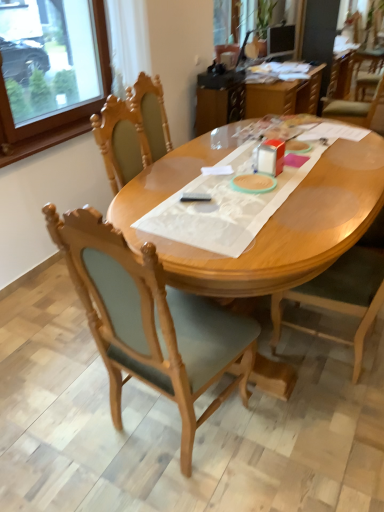
Question: Is wooden chair at center, the 2th chair viewed from the left, to the right of wooden chair at center, which is counted as the 2th chair, starting from the right, from the viewer's perspective?

Choices:
 (A) yes
 (B) no

Answer: (A)

Question: Considering the relative sizes of wooden chair at center, placed as the 1th chair when sorted from right to left, and wooden chair at center, which is counted as the 2th chair, starting from the right, in the image provided, is wooden chair at center, placed as the 1th chair when sorted from right to left, bigger than wooden chair at center, which is counted as the 2th chair, starting from the right,?

Choices:
 (A) yes
 (B) no

Answer: (A)

Question: From a real-world perspective, is wooden chair at center, the 2th chair viewed from the left, physically above wooden chair at center, placed as the 1th chair when sorted from left to right?

Choices:
 (A) no
 (B) yes

Answer: (A)

Question: Considering the relative positions of wooden chair at center, placed as the 1th chair when sorted from right to left, and wooden chair at center, placed as the 1th chair when sorted from left to right, in the image provided, is wooden chair at center, placed as the 1th chair when sorted from right to left, behind wooden chair at center, placed as the 1th chair when sorted from left to right,?

Choices:
 (A) yes
 (B) no

Answer: (A)

Question: Can you confirm if wooden chair at center, placed as the 1th chair when sorted from right to left, is taller than wooden chair at center, placed as the 1th chair when sorted from left to right?

Choices:
 (A) yes
 (B) no

Answer: (A)

Question: In the image, is wooden chair at center, placed as the 1th chair when sorted from left to right, positioned in front of or behind wooden frame at upper left?

Choices:
 (A) behind
 (B) front

Answer: (B)

Question: In terms of height, does wooden chair at center, which is counted as the 2th chair, starting from the right, look taller or shorter compared to wooden frame at upper left?

Choices:
 (A) short
 (B) tall

Answer: (B)

Question: Looking at the image, does wooden chair at center, which is counted as the 2th chair, starting from the right, seem bigger or smaller compared to wooden frame at upper left?

Choices:
 (A) big
 (B) small

Answer: (B)

Question: In terms of width, does wooden chair at center, placed as the 1th chair when sorted from left to right, look wider or thinner when compared to wooden frame at upper left?

Choices:
 (A) thin
 (B) wide

Answer: (B)

Question: Is point (120, 202) positioned closer to the camera than point (29, 143)?

Choices:
 (A) closer
 (B) farther

Answer: (A)

Question: From a real-world perspective, relative to wooden frame at upper left, is light brown wood desk at center vertically above or below?

Choices:
 (A) below
 (B) above

Answer: (A)

Question: Choose the correct answer: Is light brown wood desk at center inside wooden frame at upper left or outside it?

Choices:
 (A) outside
 (B) inside

Answer: (A)

Question: From the image's perspective, is light brown wood desk at center positioned above or below wooden frame at upper left?

Choices:
 (A) above
 (B) below

Answer: (B)

Question: In terms of width, does wooden chair at center, placed as the 1th chair when sorted from right to left, look wider or thinner when compared to translucent plastic table at upper center?

Choices:
 (A) thin
 (B) wide

Answer: (A)

Question: Do you think wooden chair at center, placed as the 1th chair when sorted from right to left, is within translucent plastic table at upper center, or outside of it?

Choices:
 (A) outside
 (B) inside

Answer: (A)